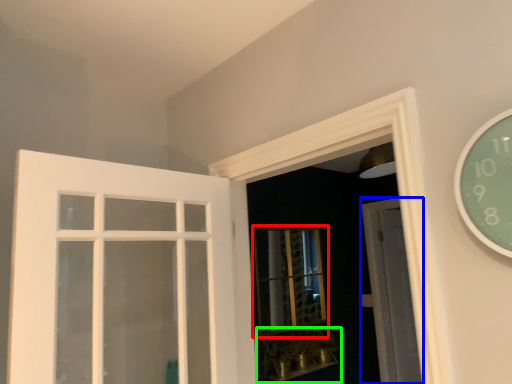
Question: Which is nearer to the bay window (highlighted by a red box)? door (highlighted by a blue box) or window sill (highlighted by a green box).

Choices:
 (A) door
 (B) window sill

Answer: (B)